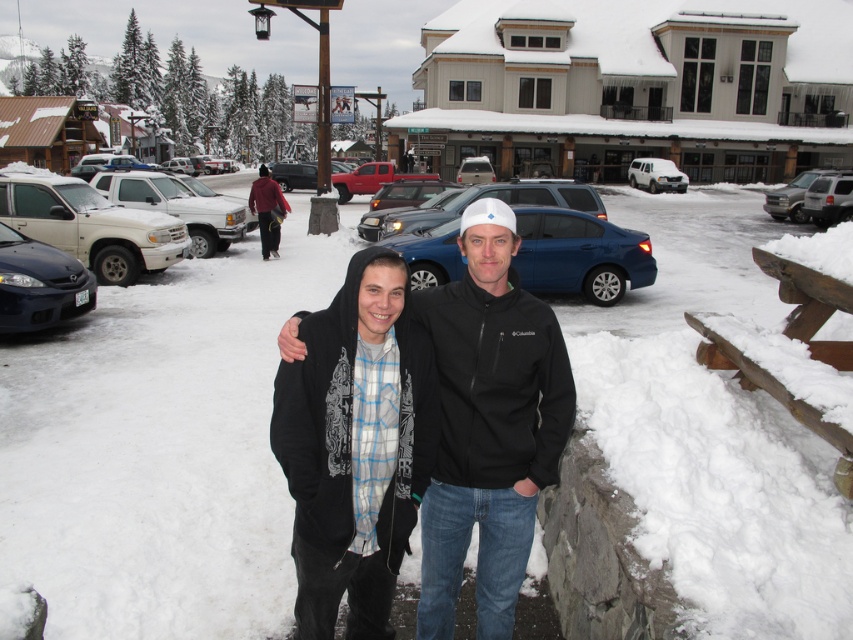
Question: Which is farther from the matte white truck at left?

Choices:
 (A) black softshell jacket at center
 (B) silver metallic truck at right
 (C) matte red jacket at center

Answer: (B)

Question: Does matte black sedan at left have a lesser width compared to satin blue suv at center?

Choices:
 (A) no
 (B) yes

Answer: (B)

Question: From the image, what is the correct spatial relationship of matte white truck at left in relation to matte black suv at center?

Choices:
 (A) above
 (B) below

Answer: (B)

Question: Which point is closer to the camera taking this photo?

Choices:
 (A) (300, 346)
 (B) (338, 163)
 (C) (151, 180)

Answer: (A)

Question: Does satin blue suv at center appear on the right side of matte black suv at center?

Choices:
 (A) no
 (B) yes

Answer: (B)

Question: Which of the following is the closest to the observer?

Choices:
 (A) (373, 180)
 (B) (505, 632)

Answer: (B)